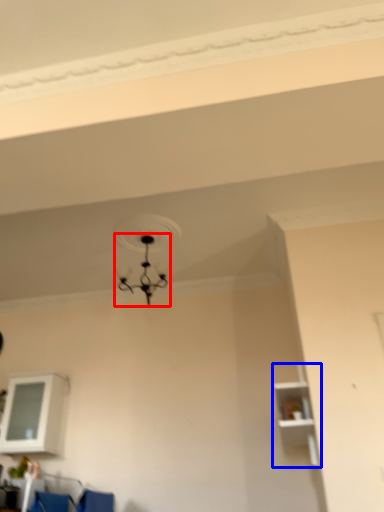
Question: Among these objects, which one is nearest to the camera, lamp (highlighted by a red box) or shelf (highlighted by a blue box)?

Choices:
 (A) lamp
 (B) shelf

Answer: (B)